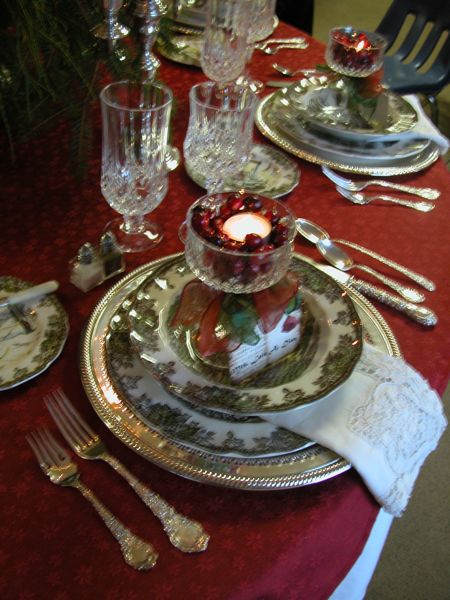
The width and height of the screenshot is (450, 600). I want to click on drink glasses, so click(136, 175), click(222, 131), click(222, 68), click(259, 17).